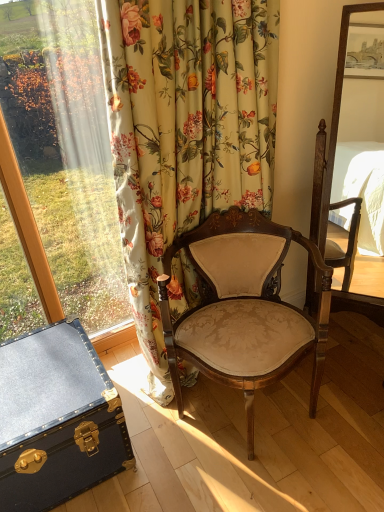
Question: Is floral fabric curtain at left to the right of blue leather trunk at lower left from the viewer's perspective?

Choices:
 (A) no
 (B) yes

Answer: (B)

Question: Is floral fabric curtain at left located outside blue leather trunk at lower left?

Choices:
 (A) yes
 (B) no

Answer: (A)

Question: From a real-world perspective, is floral fabric curtain at left below blue leather trunk at lower left?

Choices:
 (A) no
 (B) yes

Answer: (A)

Question: From the image's perspective, is floral fabric curtain at left above blue leather trunk at lower left?

Choices:
 (A) no
 (B) yes

Answer: (B)

Question: Is the position of floral fabric curtain at left more distant than that of blue leather trunk at lower left?

Choices:
 (A) yes
 (B) no

Answer: (B)

Question: Considering the positions of floral fabric curtain at left and matte beige fabric chair at center in the image, is floral fabric curtain at left taller or shorter than matte beige fabric chair at center?

Choices:
 (A) tall
 (B) short

Answer: (A)

Question: Considering the positions of floral fabric curtain at left and matte beige fabric chair at center in the image, is floral fabric curtain at left bigger or smaller than matte beige fabric chair at center?

Choices:
 (A) small
 (B) big

Answer: (A)

Question: In terms of width, does floral fabric curtain at left look wider or thinner when compared to matte beige fabric chair at center?

Choices:
 (A) wide
 (B) thin

Answer: (B)

Question: Relative to matte beige fabric chair at center, is floral fabric curtain at left in front or behind?

Choices:
 (A) behind
 (B) front

Answer: (B)

Question: From the image's perspective, is matte beige fabric chair at center located above or below floral fabric curtain at left?

Choices:
 (A) above
 (B) below

Answer: (B)

Question: Is matte beige fabric chair at center wider or thinner than floral fabric curtain at left?

Choices:
 (A) wide
 (B) thin

Answer: (A)

Question: Is matte beige fabric chair at center taller or shorter than floral fabric curtain at left?

Choices:
 (A) tall
 (B) short

Answer: (B)

Question: From a real-world perspective, is matte beige fabric chair at center above or below floral fabric curtain at left?

Choices:
 (A) below
 (B) above

Answer: (A)

Question: In the image, is floral fabric curtain at left positioned in front of or behind blue leather trunk at lower left?

Choices:
 (A) behind
 (B) front

Answer: (B)

Question: From their relative heights in the image, would you say floral fabric curtain at left is taller or shorter than blue leather trunk at lower left?

Choices:
 (A) tall
 (B) short

Answer: (A)